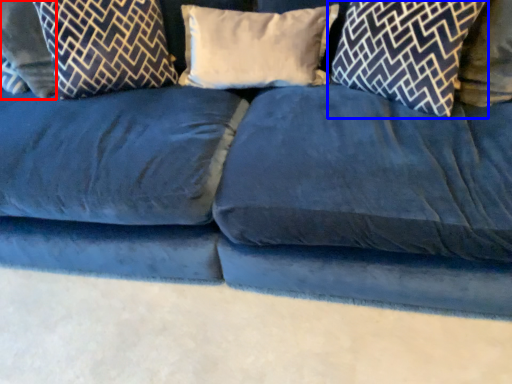
Question: Among these objects, which one is farthest to the camera, pillow (highlighted by a red box) or pillow (highlighted by a blue box)?

Choices:
 (A) pillow
 (B) pillow

Answer: (A)